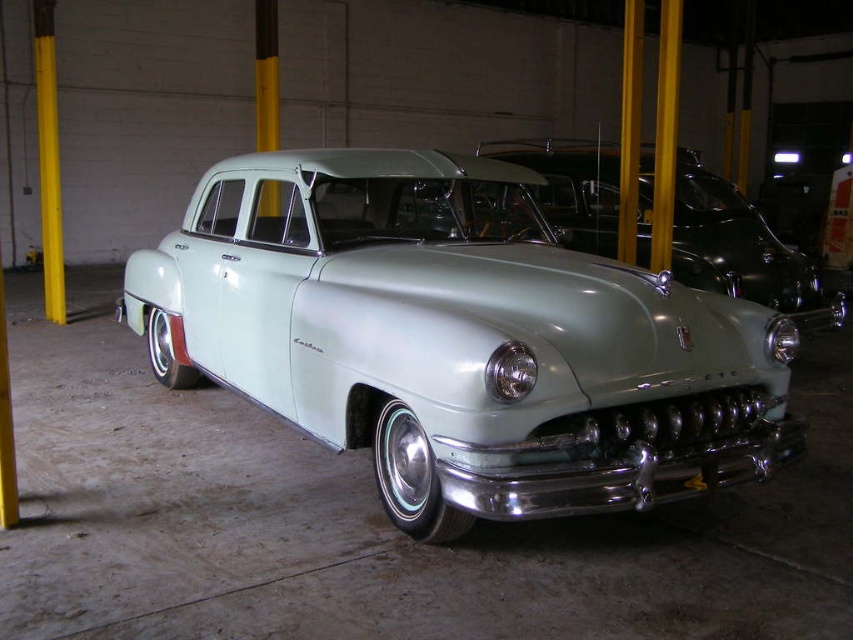
Question: Does satin light green car at center appear over light green metallic car at center?

Choices:
 (A) no
 (B) yes

Answer: (A)

Question: Which point is farther to the camera?

Choices:
 (A) (381, 225)
 (B) (683, 170)

Answer: (B)

Question: Does satin light green car at center come in front of light green metallic car at center?

Choices:
 (A) no
 (B) yes

Answer: (B)

Question: Which of the following is the closest to the observer?

Choices:
 (A) (374, 280)
 (B) (544, 140)

Answer: (A)

Question: Among these objects, which one is nearest to the camera?

Choices:
 (A) light green metallic car at center
 (B) satin light green car at center

Answer: (B)

Question: Is satin light green car at center bigger than light green metallic car at center?

Choices:
 (A) no
 (B) yes

Answer: (A)